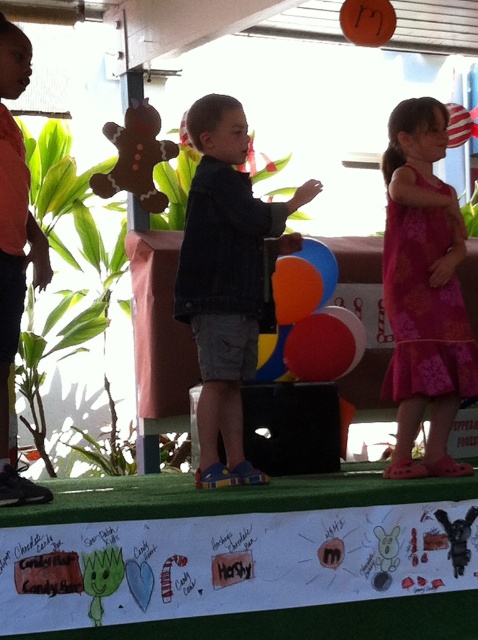
Between pink floral dress at right and felt gingerbread man at upper left, which one has less height?

felt gingerbread man at upper left

This screenshot has height=640, width=478. I want to click on pink floral dress at right, so click(423, 291).

Does denim jacket at center have a larger size compared to pink floral dress at right?

Yes, denim jacket at center is bigger than pink floral dress at right.

From the picture: Can you confirm if denim jacket at center is positioned above pink floral dress at right?

No.

Is point (232, 410) in front of point (445, 234)?

Yes, point (232, 410) is in front of point (445, 234).

I want to click on denim jacket at center, so click(x=228, y=278).

Who is taller, denim jacket at center or felt gingerbread man at upper left?

denim jacket at center

Does point (239, 460) come in front of point (150, 205)?

Yes, it is.

You are a GUI agent. You are given a task and a screenshot of the screen. Output one action in this format:
    pyautogui.click(x=<x>, y=<y>)
    Task: Click on the denim jacket at center
    The image size is (478, 640).
    Given the screenshot: What is the action you would take?
    pyautogui.click(x=228, y=278)

Find the location of a particular element. Image resolution: width=478 pixels, height=640 pixels. denim jacket at center is located at coordinates (228, 278).